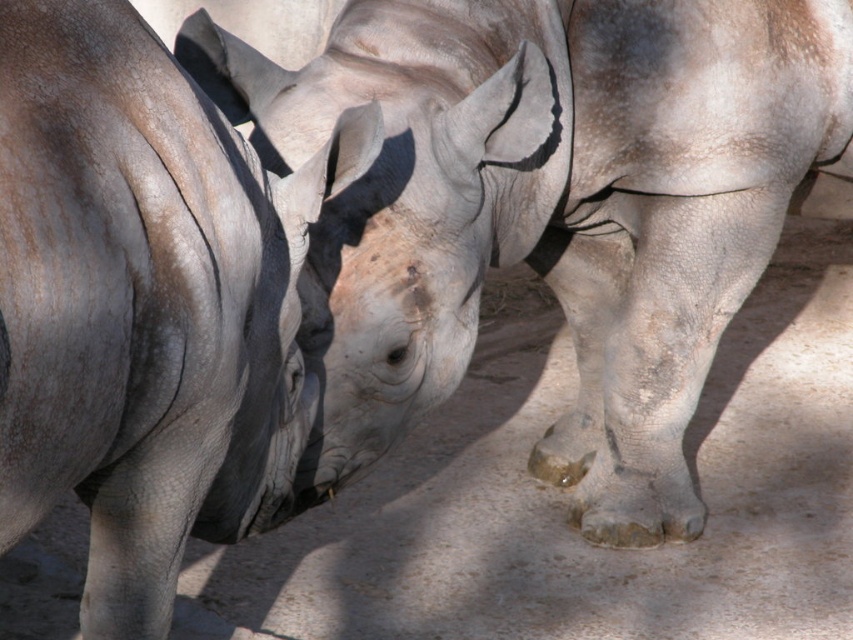
Does gray textured rhino at center appear under gray rough skin at center?

No, gray textured rhino at center is not below gray rough skin at center.

From the picture: Can you confirm if gray textured rhino at center is shorter than gray rough skin at center?

No, gray textured rhino at center is not shorter than gray rough skin at center.

Which is in front, point (645, 524) or point (221, 342)?

Point (221, 342)

I want to click on gray textured rhino at center, so click(550, 208).